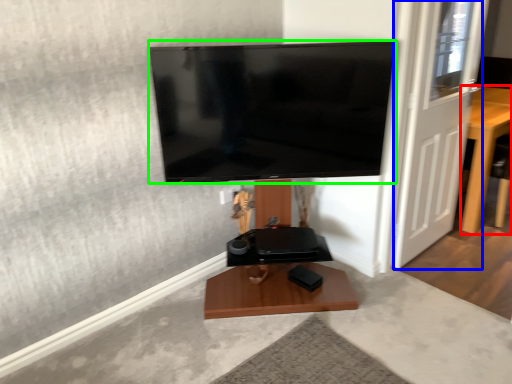
Question: Which object is positioned farthest from furniture (highlighted by a red box)? Select from door (highlighted by a blue box) and television (highlighted by a green box).

Choices:
 (A) door
 (B) television

Answer: (B)